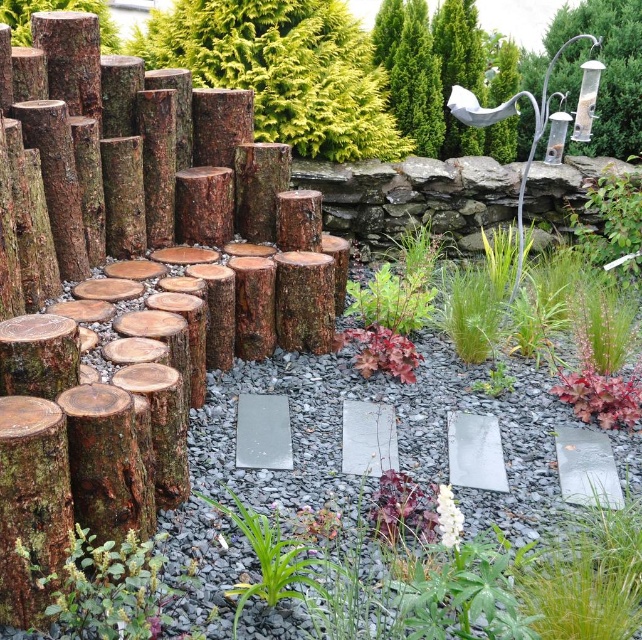
Who is more forward, (410, 342) or (494, 385)?

Point (494, 385) is more forward.

The image size is (642, 640). In order to click on dark red leafy plant at center in this screenshot , I will do `click(379, 352)`.

The height and width of the screenshot is (640, 642). I want to click on green textured tree at upper center, so click(417, 83).

Looking at this image, does green textured tree at upper center have a lesser height compared to dark red leafy plant at center?

Incorrect, green textured tree at upper center's height does not fall short of dark red leafy plant at center's.

I want to click on green textured tree at upper center, so click(417, 83).

Can you confirm if green matte plant at lower left is positioned above metallic silver bird feeder at upper right?

Incorrect, green matte plant at lower left is not positioned above metallic silver bird feeder at upper right.

Is point (58, 582) less distant than point (612, 141)?

Yes, it is in front of point (612, 141).

Where is `green matte plant at lower left`? green matte plant at lower left is located at coordinates (105, 588).